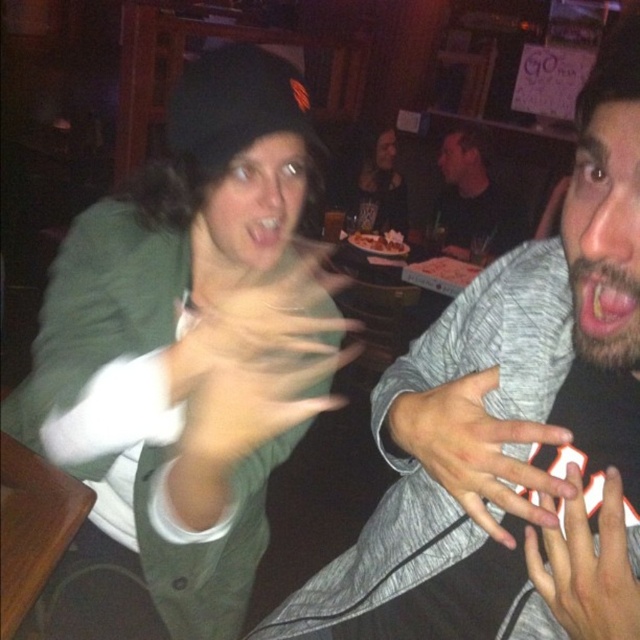
You are a photographer trying to capture the perfect shot of the two people in the scene. You notice the smooth skin hand at center and the pink flesh at center. Which object should you focus on if you want to capture the larger one in your photo?

The smooth skin hand at center is bigger than the pink flesh at center, so you should focus on the smooth skin hand at center to capture the larger one in your photo.

You are a photographer trying to capture the interaction between the two people in the center of the image. Based on the positioning of the smooth skin hand at center and the white matte hand at center, which hand is closer to the camera?

The smooth skin hand at center is closer to the camera because the white matte hand at center is behind it.